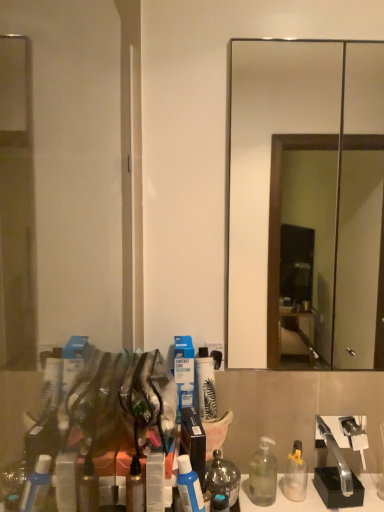
Question: Considering the positions of blue cardboard box at center, the first toiletry in the left-to-right sequence, and transparent glass door at left in the image, is blue cardboard box at center, the first toiletry in the left-to-right sequence, taller or shorter than transparent glass door at left?

Choices:
 (A) tall
 (B) short

Answer: (B)

Question: Considering the positions of point (175, 368) and point (72, 218), is point (175, 368) closer or farther from the camera than point (72, 218)?

Choices:
 (A) farther
 (B) closer

Answer: (B)

Question: Which object is the closest to the clear plastic bottle at lower right, which is the third bottle from front to back?

Choices:
 (A) smooth glass mirror at center
 (B) translucent amber bottle at center, which ranks as the 1th bottle in front-to-back order
 (C) transparent glass door at left
 (D) white matte spray can at center, which is the first toiletry from right to left
 (E) satin silver mouthwash at lower center

Answer: (E)

Question: Which object is the closest to the white matte spray can at center, which is the first toiletry from right to left?

Choices:
 (A) translucent amber bottle at center, positioned as the first bottle in left-to-right order
 (B) blue matte lotion at center, which is the 2th bottle in back-to-front order
 (C) transparent glass door at left
 (D) satin silver mouthwash at lower center
 (E) smooth glass mirror at center

Answer: (D)